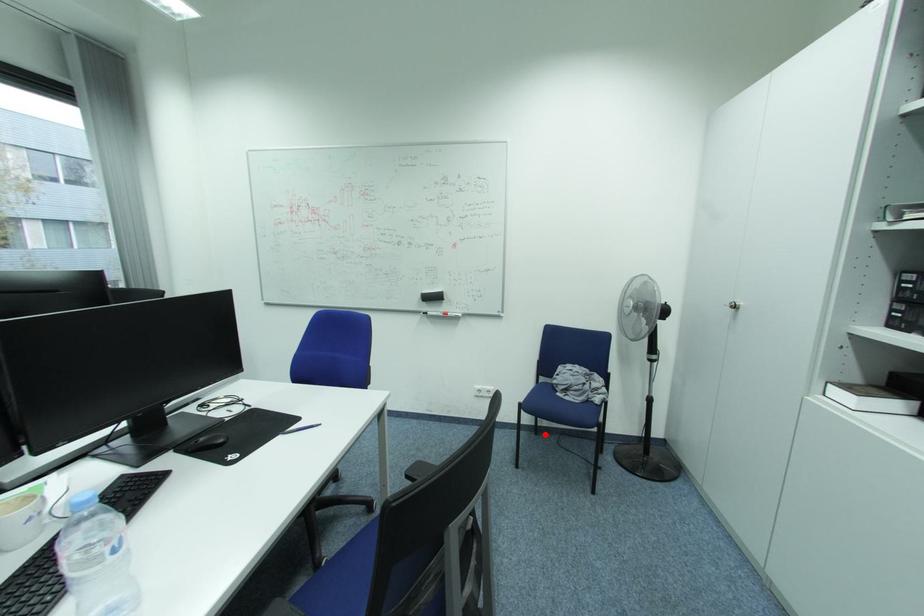
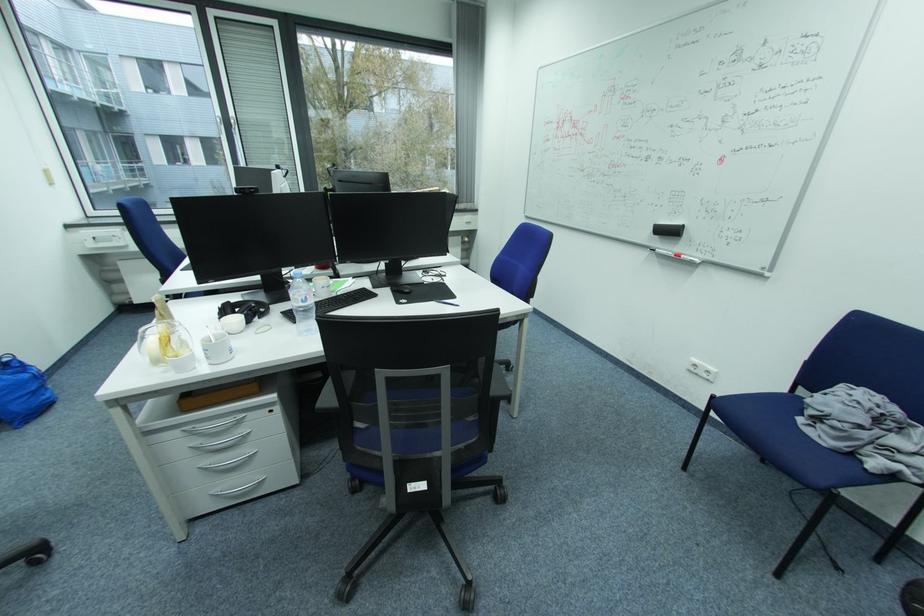
Question: I am providing you with two images of the same scene from different viewpoints. Given a red point in image1, look at the same physical point in image2. Is it:

Choices:
 (A) Closer to the viewpoint
 (B) Farther from the viewpoint

Answer: (A)